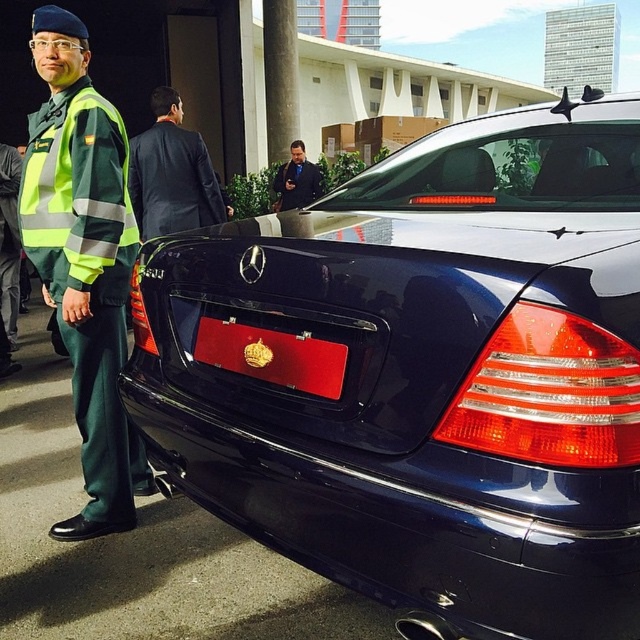
Does glossy black car at center lie behind red leather license plate at center?

No, glossy black car at center is closer to the viewer.

Between glossy black car at center and red leather license plate at center, which one is positioned higher?

glossy black car at center is above.

Is point (248, 499) positioned in front of point (323, 397)?

That is False.

Locate an element on the screen. The image size is (640, 640). glossy black car at center is located at coordinates (428, 374).

Who is positioned more to the left, glossy black car at center or black fabric coat at center?

black fabric coat at center is more to the left.

Who is taller, glossy black car at center or black fabric coat at center?

glossy black car at center is taller.

Is point (593, 221) behind point (292, 189)?

No, it is in front of (292, 189).

Locate an element on the screen. glossy black car at center is located at coordinates (428, 374).

Who is more distant from viewer, (108, 312) or (205, 324)?

The point (108, 312) is more distant.

What are the coordinates of `green reflective uniform at left` in the screenshot? It's located at (88, 275).

At what (x,y) coordinates should I click in order to perform the action: click on green reflective uniform at left. Please return your answer as a coordinate pair (x, y). Looking at the image, I should click on (88, 275).